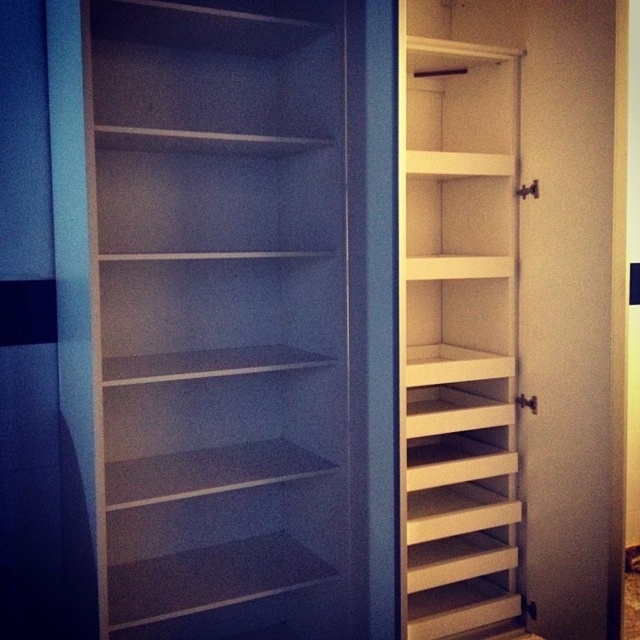
Question: Which point is farther to the camera?

Choices:
 (A) (416, 518)
 (B) (275, 8)

Answer: (A)

Question: In this image, where is white matte bookshelf at left located relative to white wood bookshelf at right?

Choices:
 (A) below
 (B) above

Answer: (A)

Question: Observing the image, what is the correct spatial positioning of white matte bookshelf at left in reference to white wood bookshelf at right?

Choices:
 (A) right
 (B) left

Answer: (B)

Question: Which point appears closest to the camera in this image?

Choices:
 (A) (454, 524)
 (B) (324, 32)

Answer: (B)

Question: Does white matte bookshelf at left have a larger size compared to white wood bookshelf at right?

Choices:
 (A) no
 (B) yes

Answer: (B)